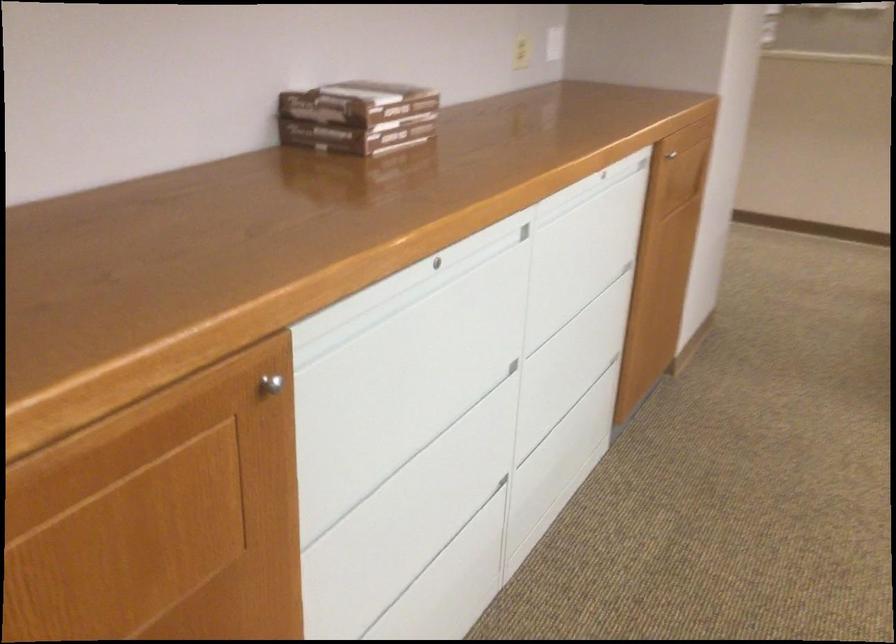
Find where to pull the recessed cabinet pull. Please return your answer as a coordinate pair (x, y).

(400, 301)